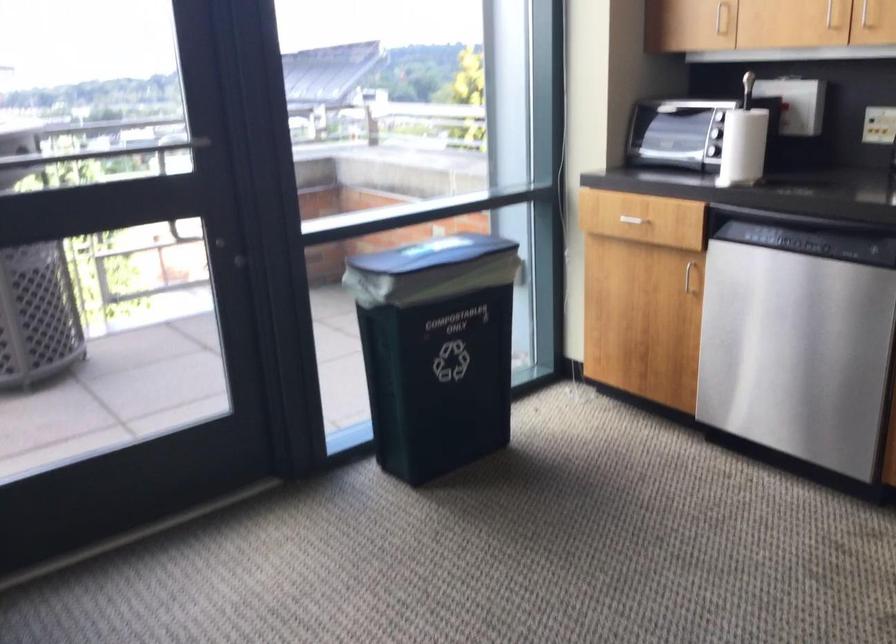
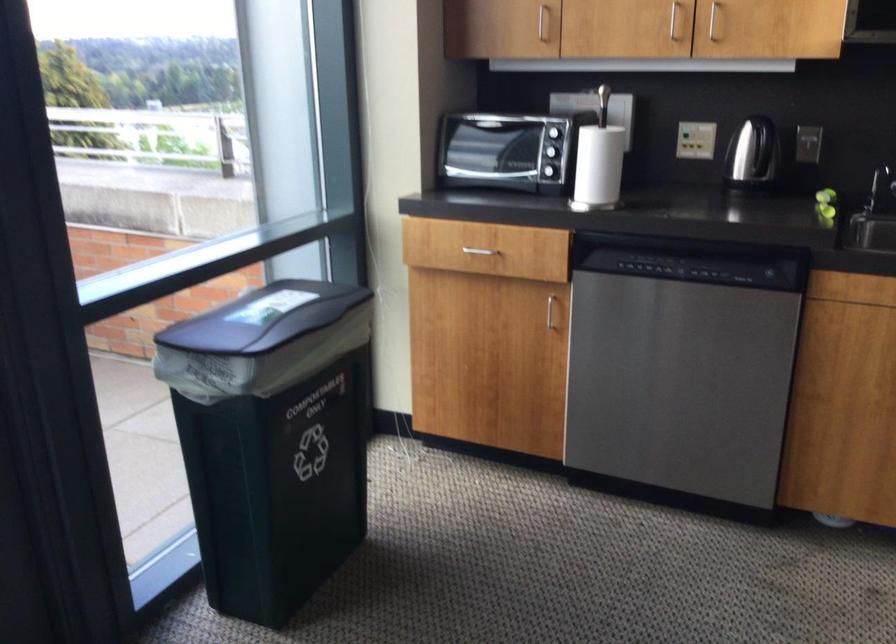
Find the pixel in the second image that matches point (691, 277) in the first image.

(549, 310)